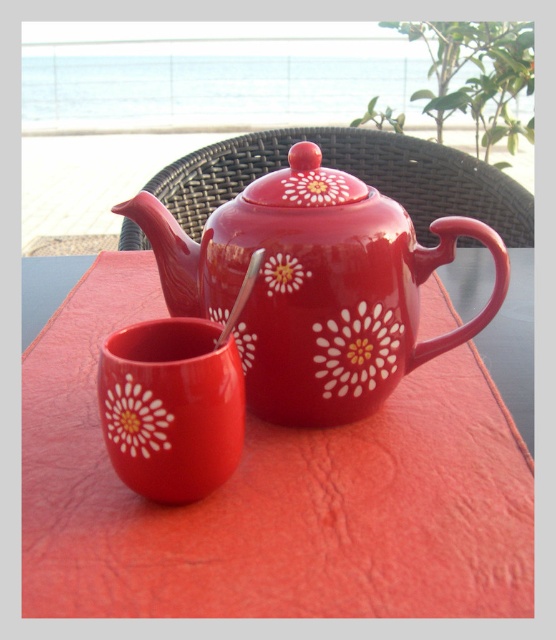
You are a guest at a tea party and want to reach both the matte ceramic teapot at center and the matte ceramic mug at lower left. Which object will you grab first if you want to pick up the one closer to you?

You will grab the matte ceramic teapot at center first because it is closer to you than the matte ceramic mug at lower left.

You are setting up a tea service on the glossy ceramic table at center and need to place the matte ceramic teapot at center. Considering their heights, will the teapot fit comfortably on the table without overhanging the edges?

The glossy ceramic table at center is taller than the matte ceramic teapot at center, so the teapot will fit comfortably on the table without overhanging the edges.